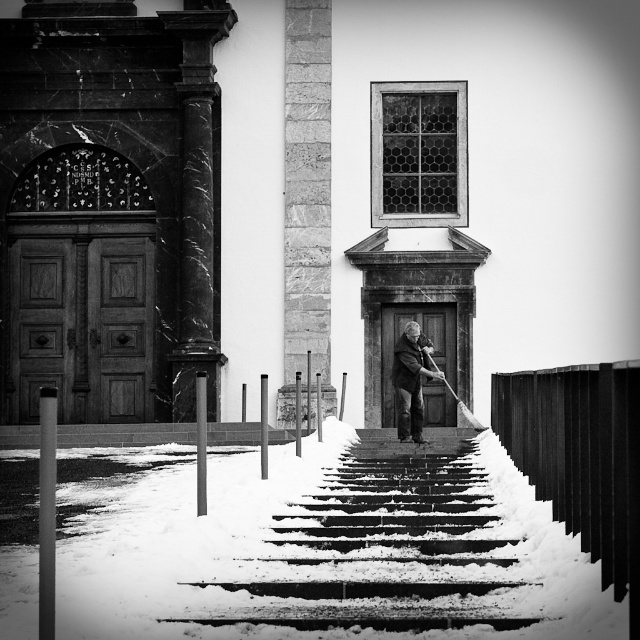
Consider the image. Is the position of snow-covered concrete stairs at center more distant than that of dark gray wool sweater at center?

No, it is in front of dark gray wool sweater at center.

Is snow-covered concrete stairs at center wider than dark gray wool sweater at center?

In fact, snow-covered concrete stairs at center might be narrower than dark gray wool sweater at center.

Is point (310, 579) closer to camera compared to point (419, 422)?

Yes, point (310, 579) is closer to viewer.

Locate an element on the screen. snow-covered concrete stairs at center is located at coordinates (387, 547).